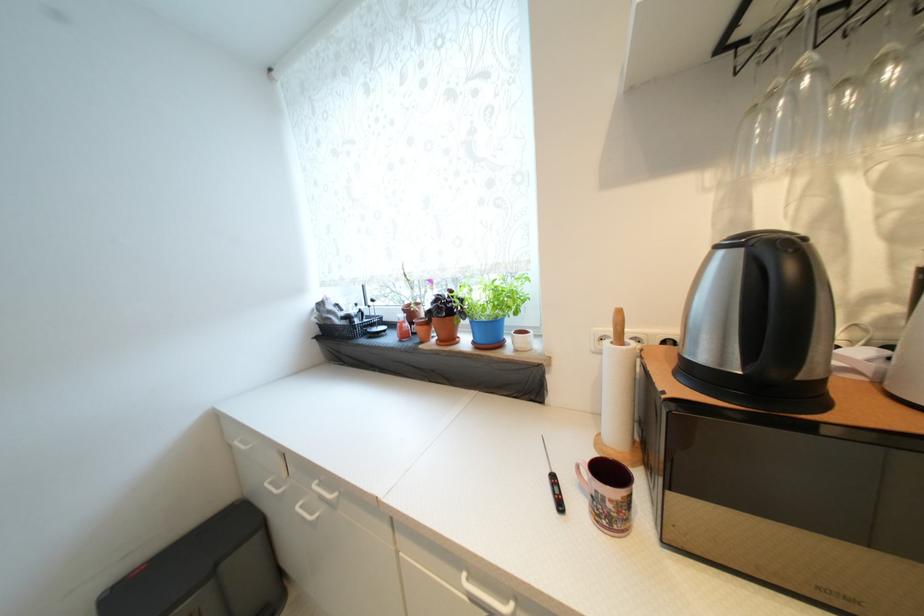
What do you see at coordinates (445, 330) in the screenshot?
I see `the small brown pot` at bounding box center [445, 330].